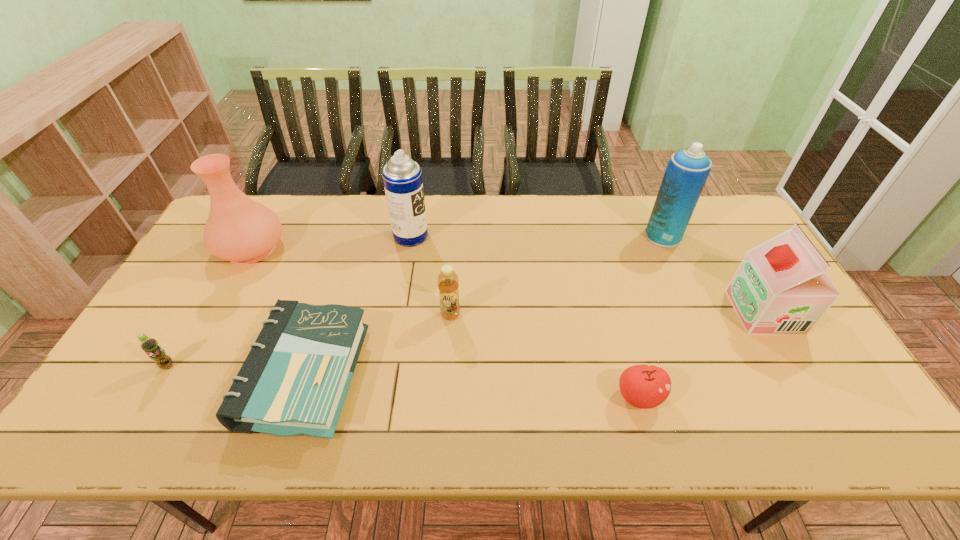
This screenshot has height=540, width=960. In order to click on the right aerosol can in this screenshot , I will do `click(687, 171)`.

Locate an element on the screen. This screenshot has height=540, width=960. the fifth object from right to left is located at coordinates (402, 177).

Identify the location of vase. The width and height of the screenshot is (960, 540). (240, 230).

Locate an element on the screen. The image size is (960, 540). soya milk is located at coordinates (781, 287).

Find the location of a particular element. the fifth shortest object is located at coordinates (781, 287).

You are a GUI agent. You are given a task and a screenshot of the screen. Output one action in this format:
    pyautogui.click(x=<x>, y=<y>)
    Task: Click on the bottle
    The image size is (960, 540).
    Given the screenshot: What is the action you would take?
    pyautogui.click(x=448, y=282)

At what (x,y) coordinates should I click in order to perform the action: click on the fourth object from right to left. Please return your answer as a coordinate pair (x, y). Image resolution: width=960 pixels, height=540 pixels. Looking at the image, I should click on (448, 282).

Image resolution: width=960 pixels, height=540 pixels. In order to click on soda in this screenshot , I will do [x=150, y=346].

This screenshot has height=540, width=960. In order to click on apple in this screenshot , I will do `click(643, 386)`.

This screenshot has width=960, height=540. In order to click on the shortest object in this screenshot , I will do `click(294, 381)`.